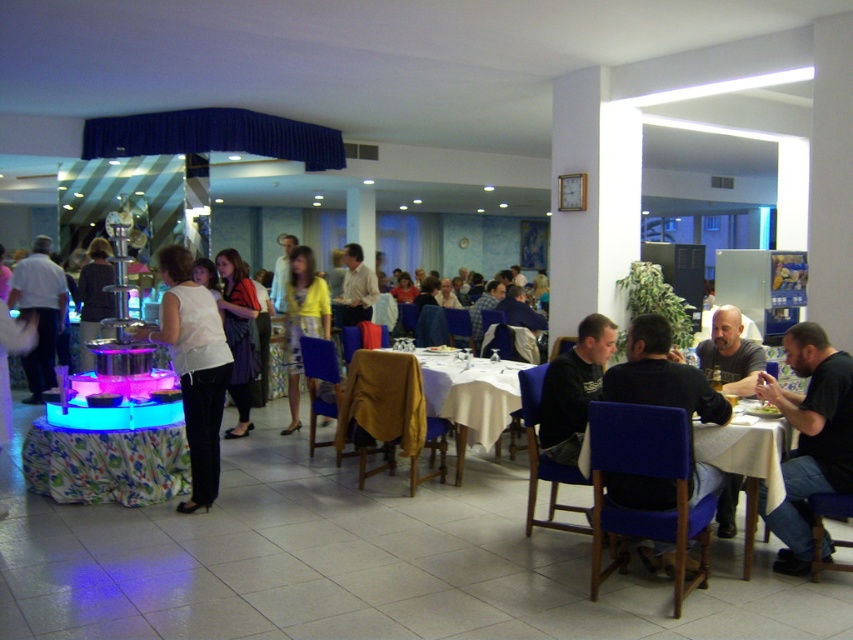
You are a photographer standing at the entrance of the dining area. You want to take a photo of the black matte shirt at right. Where should you position yourself to capture it in the frame?

The black matte shirt at right is located at point 0.686 on the horizontal axis and 0.951 on the vertical axis. To capture it in the frame, position yourself so that your camera is aligned with these coordinates.

You are a photographer setting up a shoot in the dining area. You need to position two subjects wearing the black matte shirt at right and the white fabric dress at center. Since you want to emphasize the size difference between them, which subject should you place closer to the camera?

The black matte shirt at right is smaller than the white fabric dress at center, so to emphasize the size difference, place the black matte shirt at right closer to the camera.

You are standing at the camera position and want to walk to the floral fabric table at center. The hallway leading to the table is 4 meters wide. Can you walk straight to the table without any obstacles?

The distance between you and the floral fabric table at center is 4.38 meters, and the hallway is 4 meters wide. Since the hallway width is less than the required distance, you can walk straight to the table without any obstacles.